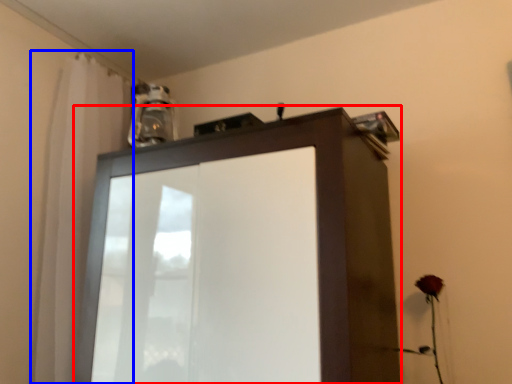
Question: Which object is closer to the camera taking this photo, cupboard (highlighted by a red box) or shower curtain (highlighted by a blue box)?

Choices:
 (A) cupboard
 (B) shower curtain

Answer: (A)